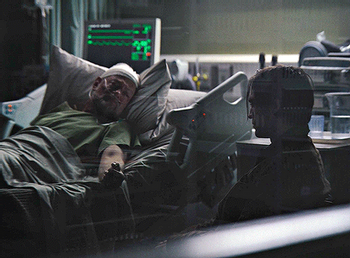
Locate an element on the screen. The image size is (350, 258). wall is located at coordinates (256, 29).